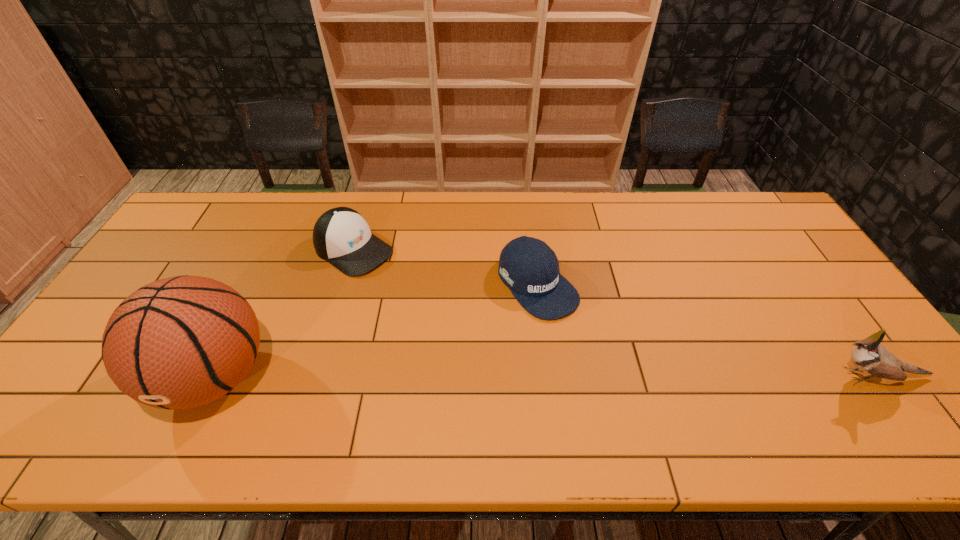
Locate an element on the screen. vacant space at the near edge is located at coordinates (367, 384).

In the image, there is a desktop. Where is `free space at the right edge`? The height and width of the screenshot is (540, 960). free space at the right edge is located at coordinates (819, 326).

Where is `free space between the basketball and the bird`? free space between the basketball and the bird is located at coordinates (544, 376).

In order to click on unoccupied area between the rightmost object and the tallest object in this screenshot , I will do `click(544, 376)`.

In order to click on vacant region between the basketball and the bird in this screenshot , I will do [544, 376].

Image resolution: width=960 pixels, height=540 pixels. I want to click on vacant space in between the bird and the second object from right to left, so click(x=706, y=330).

Find the location of a particular element. vacant area between the bird and the second object from right to left is located at coordinates (706, 330).

Where is `free space between the second object from right to left and the cap`? free space between the second object from right to left and the cap is located at coordinates (445, 267).

Locate an element on the screen. The image size is (960, 540). vacant space in between the third shortest object and the basketball is located at coordinates (544, 376).

Identify the location of free space between the cap and the third object from left to right. The image size is (960, 540). (445, 267).